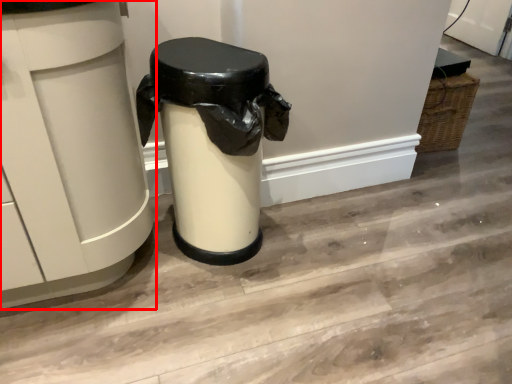
Question: From the image's perspective, where is waste container (annotated by the red box) located in relation to waste container in the image?

Choices:
 (A) below
 (B) above

Answer: (B)